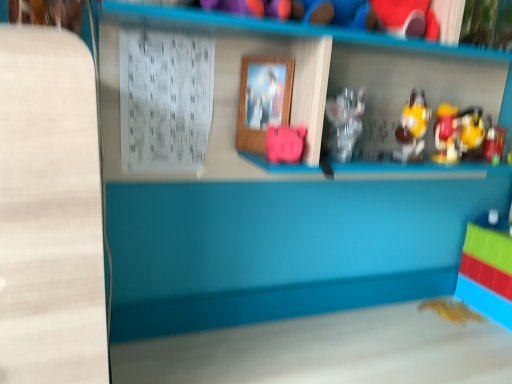
Question: Considering the positions of point (424, 109) and point (492, 134), is point (424, 109) closer or farther from the camera than point (492, 134)?

Choices:
 (A) farther
 (B) closer

Answer: (B)

Question: In terms of size, does yellow plastic toy at upper right, which is the 2th toy from top to bottom, appear bigger or smaller than metallic gold toy at right, the third toy when ordered from top to bottom?

Choices:
 (A) small
 (B) big

Answer: (B)

Question: Which of these objects is positioned farthest from the translucent plastic toy at lower right, the second toy when ordered from bottom to top?

Choices:
 (A) metallic gold toy at right, the third toy when ordered from top to bottom
 (B) gold metallic bat at lower right, which appears as the sixth toy when viewed from the top
 (C) rubberized red plush toy at upper right, which is the 2th toy in left-to-right order
 (D) pink matte piggy bank at center, which appears as the 6th toy when viewed from the right
 (E) yellow plastic toy at upper right, positioned as the 5th toy in bottom-to-top order

Answer: (D)

Question: Considering the real-world distances, which object is closest to the wooden picture frame at center?

Choices:
 (A) gold metallic bat at lower right, which appears as the sixth toy when viewed from the top
 (B) translucent plastic toy at lower right, the fifth toy from the top
 (C) metallic gold toy at right, acting as the second toy starting from the right
 (D) yellow plastic toy at upper right, which is the 2th toy from top to bottom
 (E) rubberized red plush toy at upper right, which is the 2th toy in left-to-right order

Answer: (E)